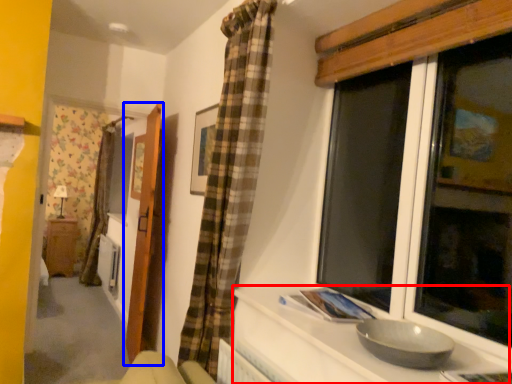
Question: Which object appears closest to the camera in this image, counter top (highlighted by a red box) or door (highlighted by a blue box)?

Choices:
 (A) counter top
 (B) door

Answer: (A)